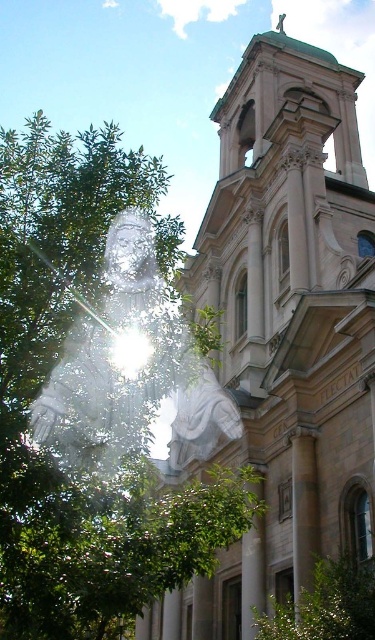
You are an architect visiting a historical site. You observe the white marble church at center and the green leafy tree at left. Which object appears smaller in the image?

The white marble church at center appears smaller compared to the green leafy tree at left according to the description.